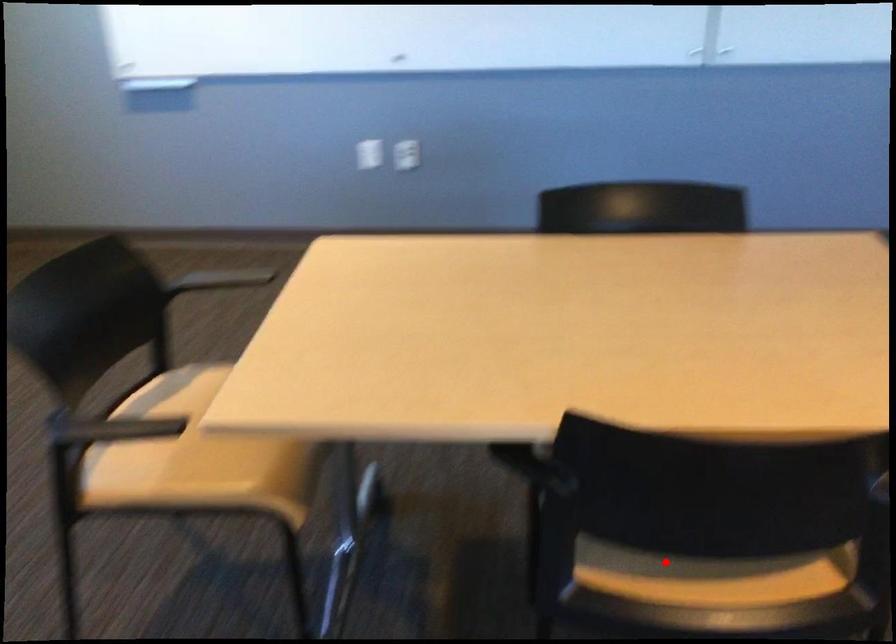
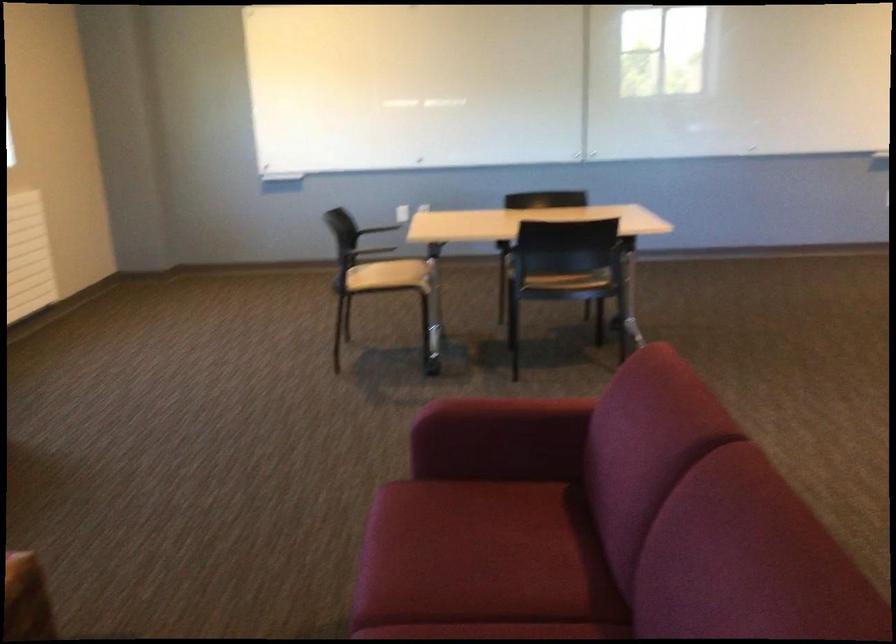
Question: I am providing you with two images of the same scene from different viewpoints. In image1, a red point is highlighted. Considering the same 3D point in image2, which of the following is correct?

Choices:
 (A) It is closer
 (B) It is farther

Answer: (B)